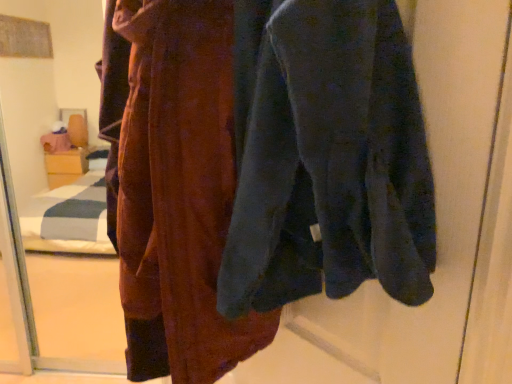
Question: From the image's perspective, is velvet dark blue sweatshirt at center beneath velvet maroon robe at center?

Choices:
 (A) no
 (B) yes

Answer: (A)

Question: Is velvet dark blue sweatshirt at center beside velvet maroon robe at center?

Choices:
 (A) no
 (B) yes

Answer: (A)

Question: Considering the relative sizes of velvet dark blue sweatshirt at center and velvet maroon robe at center in the image provided, is velvet dark blue sweatshirt at center taller than velvet maroon robe at center?

Choices:
 (A) no
 (B) yes

Answer: (A)

Question: Is velvet maroon robe at center at the back of velvet dark blue sweatshirt at center?

Choices:
 (A) no
 (B) yes

Answer: (A)

Question: From the image's perspective, is velvet dark blue sweatshirt at center located above velvet maroon robe at center?

Choices:
 (A) no
 (B) yes

Answer: (B)

Question: Considering the relative sizes of velvet dark blue sweatshirt at center and velvet maroon robe at center in the image provided, is velvet dark blue sweatshirt at center thinner than velvet maroon robe at center?

Choices:
 (A) no
 (B) yes

Answer: (B)

Question: From the image's perspective, is velvet maroon robe at center under velvet dark blue sweatshirt at center?

Choices:
 (A) yes
 (B) no

Answer: (A)

Question: Is velvet dark blue sweatshirt at center inside velvet maroon robe at center?

Choices:
 (A) yes
 (B) no

Answer: (B)

Question: Can we say velvet maroon robe at center lies outside velvet dark blue sweatshirt at center?

Choices:
 (A) yes
 (B) no

Answer: (A)

Question: Is velvet maroon robe at center not near velvet dark blue sweatshirt at center?

Choices:
 (A) yes
 (B) no

Answer: (B)

Question: Is velvet maroon robe at center aimed at velvet dark blue sweatshirt at center?

Choices:
 (A) yes
 (B) no

Answer: (B)

Question: Considering the relative sizes of velvet maroon robe at center and velvet dark blue sweatshirt at center in the image provided, is velvet maroon robe at center shorter than velvet dark blue sweatshirt at center?

Choices:
 (A) yes
 (B) no

Answer: (B)

Question: In the image, is velvet dark blue sweatshirt at center positioned in front of or behind velvet maroon robe at center?

Choices:
 (A) front
 (B) behind

Answer: (A)